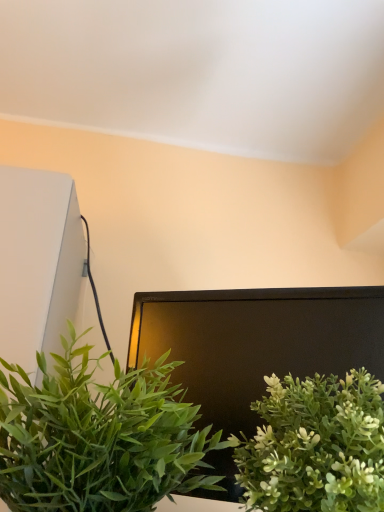
Question: From the image's perspective, is green leafy plant at center, the first houseplant in the left-to-right sequence, located beneath green matte plant at lower right, positioned as the second houseplant in left-to-right order?

Choices:
 (A) no
 (B) yes

Answer: (A)

Question: Considering the relative positions of green leafy plant at center, the 2th houseplant when ordered from right to left, and green matte plant at lower right, positioned as the second houseplant in left-to-right order, in the image provided, is green leafy plant at center, the 2th houseplant when ordered from right to left, to the right of green matte plant at lower right, positioned as the second houseplant in left-to-right order, from the viewer's perspective?

Choices:
 (A) no
 (B) yes

Answer: (A)

Question: Could green matte plant at lower right, the first houseplant viewed from the right, be considered to be inside green leafy plant at center, the 2th houseplant when ordered from right to left?

Choices:
 (A) no
 (B) yes

Answer: (A)

Question: Is green leafy plant at center, the 2th houseplant when ordered from right to left, outside of green matte plant at lower right, positioned as the second houseplant in left-to-right order?

Choices:
 (A) yes
 (B) no

Answer: (A)

Question: Is green leafy plant at center, the 2th houseplant when ordered from right to left, behind green matte plant at lower right, positioned as the second houseplant in left-to-right order?

Choices:
 (A) yes
 (B) no

Answer: (B)

Question: From a real-world perspective, does green leafy plant at center, the 2th houseplant when ordered from right to left, sit lower than green matte plant at lower right, positioned as the second houseplant in left-to-right order?

Choices:
 (A) no
 (B) yes

Answer: (A)

Question: Can you confirm if green matte plant at lower right, the first houseplant viewed from the right, is positioned to the right of green leafy plant at center, the first houseplant in the left-to-right sequence?

Choices:
 (A) yes
 (B) no

Answer: (A)

Question: Considering the relative positions of green matte plant at lower right, the first houseplant viewed from the right, and green leafy plant at center, the first houseplant in the left-to-right sequence, in the image provided, is green matte plant at lower right, the first houseplant viewed from the right, to the left of green leafy plant at center, the first houseplant in the left-to-right sequence, from the viewer's perspective?

Choices:
 (A) no
 (B) yes

Answer: (A)

Question: From the image's perspective, would you say green matte plant at lower right, the first houseplant viewed from the right, is shown under green leafy plant at center, the first houseplant in the left-to-right sequence?

Choices:
 (A) no
 (B) yes

Answer: (B)

Question: From the image's perspective, is green matte plant at lower right, positioned as the second houseplant in left-to-right order, on top of green leafy plant at center, the 2th houseplant when ordered from right to left?

Choices:
 (A) no
 (B) yes

Answer: (A)

Question: Does green matte plant at lower right, positioned as the second houseplant in left-to-right order, lie in front of green leafy plant at center, the first houseplant in the left-to-right sequence?

Choices:
 (A) yes
 (B) no

Answer: (B)

Question: Is green matte plant at lower right, positioned as the second houseplant in left-to-right order, outside of green leafy plant at center, the first houseplant in the left-to-right sequence?

Choices:
 (A) no
 (B) yes

Answer: (B)

Question: Considering the positions of point (324, 493) and point (23, 499), is point (324, 493) closer or farther from the camera than point (23, 499)?

Choices:
 (A) closer
 (B) farther

Answer: (B)